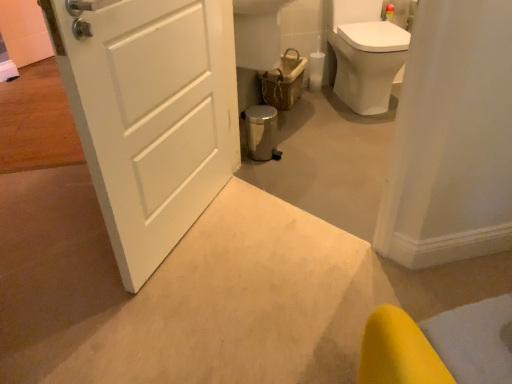
This screenshot has height=384, width=512. Identify the location of white matte door at center. (150, 114).

Where is `woven brown basket at center`? woven brown basket at center is located at coordinates (284, 81).

This screenshot has height=384, width=512. Identify the location of bidet above the woven brown basket at center (from a real-world perspective). (368, 63).

Considering the positions of objects white glossy toilet at upper right and woven brown basket at center in the image provided, who is behind, white glossy toilet at upper right or woven brown basket at center?

Positioned behind is woven brown basket at center.

Could you tell me if white glossy toilet at upper right is facing woven brown basket at center?

No.

From the image's perspective, is white glossy toilet at upper right above or below woven brown basket at center?

Clearly, from the image's perspective, white glossy toilet at upper right is above woven brown basket at center.

From the picture: Are woven brown basket at center and white matte door at center located far from each other?

Yes, woven brown basket at center is far from white matte door at center.

From the picture: Would you say woven brown basket at center contains white matte door at center?

No, white matte door at center is not surrounded by woven brown basket at center.

In the image, is woven brown basket at center positioned in front of or behind white matte door at center?

woven brown basket at center is positioned farther from the viewer than white matte door at center.

Locate an element on the screen. The image size is (512, 384). basket on the right of the white matte door at center is located at coordinates (284, 81).

Does white matte door at center have a greater height compared to white glossy toilet at upper right?

Yes, white matte door at center is taller than white glossy toilet at upper right.

Which is correct: white matte door at center is inside white glossy toilet at upper right, or outside of it?

white matte door at center is not enclosed by white glossy toilet at upper right.

From the image's perspective, who appears lower, white matte door at center or woven brown basket at center?

white matte door at center, from the image's perspective.

Is white matte door at center aimed at woven brown basket at center?

No.

Is white matte door at center to the left of woven brown basket at center from the viewer's perspective?

Yes.

Considering the points (68, 29) and (298, 59), which point is in front, point (68, 29) or point (298, 59)?

The point (68, 29) is in front.

Who is bigger, white glossy toilet at upper right or white matte door at center?

Bigger between the two is white glossy toilet at upper right.

Is white glossy toilet at upper right far away from white matte door at center?

Yes, white glossy toilet at upper right and white matte door at center are located far from each other.

Is white matte door at center completely or partially inside white glossy toilet at upper right?

No, white matte door at center is not inside white glossy toilet at upper right.

From a real-world perspective, is woven brown basket at center physically above white glossy toilet at upper right?

Incorrect, from a real-world perspective, woven brown basket at center is lower than white glossy toilet at upper right.

Does woven brown basket at center contain white glossy toilet at upper right?

No, white glossy toilet at upper right is not inside woven brown basket at center.

Is woven brown basket at center shorter than white glossy toilet at upper right?

Yes.

Where is `basket that appears below the white glossy toilet at upper right (from a real-world perspective)`? basket that appears below the white glossy toilet at upper right (from a real-world perspective) is located at coordinates (284, 81).

Where is `bidet located on the right of woven brown basket at center`? The image size is (512, 384). bidet located on the right of woven brown basket at center is located at coordinates (368, 63).

You are a GUI agent. You are given a task and a screenshot of the screen. Output one action in this format:
    pyautogui.click(x=<x>, y=<y>)
    Task: Click on the door in front of the woven brown basket at center
    
    Given the screenshot: What is the action you would take?
    pyautogui.click(x=150, y=114)

From the image, which object appears to be nearer to woven brown basket at center, white glossy toilet at upper right or white matte door at center?

Based on the image, white glossy toilet at upper right appears to be nearer to woven brown basket at center.

Considering their positions, is woven brown basket at center positioned further to white matte door at center than white glossy toilet at upper right?

white glossy toilet at upper right is further to white matte door at center.

Looking at the image, which one is located closer to white glossy toilet at upper right, woven brown basket at center or white matte door at center?

Based on the image, woven brown basket at center appears to be nearer to white glossy toilet at upper right.

Looking at the image, which one is located further to white matte door at center, white glossy toilet at upper right or woven brown basket at center?

white glossy toilet at upper right is positioned further to the anchor white matte door at center.

Which object lies nearer to the anchor point woven brown basket at center, white matte door at center or white glossy toilet at upper right?

Based on the image, white glossy toilet at upper right appears to be nearer to woven brown basket at center.

Estimate the real-world distances between objects in this image. Which object is closer to white glossy toilet at upper right, white matte door at center or woven brown basket at center?

woven brown basket at center is closer to white glossy toilet at upper right.

Find the location of `bidet positioned between white matte door at center and woven brown basket at center from near to far`. bidet positioned between white matte door at center and woven brown basket at center from near to far is located at coordinates (368, 63).